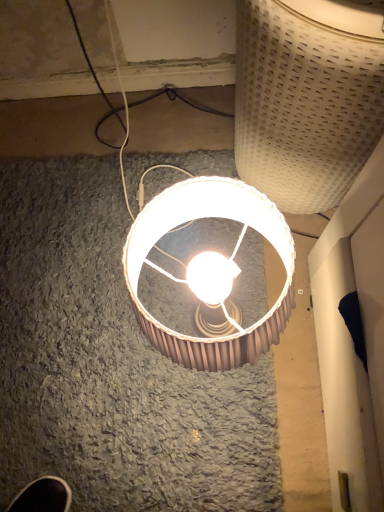
Question: Can you confirm if white woven basket at upper right, positioned as the first lamp in top-to-bottom order, is taller than matte brown lampshade at center, positioned as the first lamp in bottom-to-top order?

Choices:
 (A) yes
 (B) no

Answer: (A)

Question: Is white woven basket at upper right, positioned as the first lamp in top-to-bottom order, further to camera compared to matte brown lampshade at center, positioned as the first lamp in bottom-to-top order?

Choices:
 (A) no
 (B) yes

Answer: (A)

Question: Is matte brown lampshade at center, positioned as the first lamp in bottom-to-top order, completely or partially inside white woven basket at upper right, arranged as the second lamp when ordered from the bottom?

Choices:
 (A) no
 (B) yes

Answer: (A)

Question: Can we say white woven basket at upper right, arranged as the second lamp when ordered from the bottom, lies outside matte brown lampshade at center, the 2th lamp when ordered from top to bottom?

Choices:
 (A) no
 (B) yes

Answer: (B)

Question: Considering the relative sizes of white woven basket at upper right, arranged as the second lamp when ordered from the bottom, and matte brown lampshade at center, positioned as the first lamp in bottom-to-top order, in the image provided, is white woven basket at upper right, arranged as the second lamp when ordered from the bottom, thinner than matte brown lampshade at center, positioned as the first lamp in bottom-to-top order,?

Choices:
 (A) yes
 (B) no

Answer: (B)

Question: From a real-world perspective, does white woven basket at upper right, arranged as the second lamp when ordered from the bottom, sit lower than matte brown lampshade at center, the 2th lamp when ordered from top to bottom?

Choices:
 (A) no
 (B) yes

Answer: (A)

Question: Is matte brown lampshade at center, the 2th lamp when ordered from top to bottom, next to white woven basket at upper right, positioned as the first lamp in top-to-bottom order?

Choices:
 (A) yes
 (B) no

Answer: (B)

Question: Can you confirm if matte brown lampshade at center, the 2th lamp when ordered from top to bottom, is shorter than white woven basket at upper right, arranged as the second lamp when ordered from the bottom?

Choices:
 (A) yes
 (B) no

Answer: (A)

Question: Is matte brown lampshade at center, positioned as the first lamp in bottom-to-top order, completely or partially outside of white woven basket at upper right, arranged as the second lamp when ordered from the bottom?

Choices:
 (A) no
 (B) yes

Answer: (B)

Question: Does matte brown lampshade at center, positioned as the first lamp in bottom-to-top order, appear on the right side of white woven basket at upper right, positioned as the first lamp in top-to-bottom order?

Choices:
 (A) yes
 (B) no

Answer: (B)

Question: Does matte brown lampshade at center, positioned as the first lamp in bottom-to-top order, come behind white woven basket at upper right, arranged as the second lamp when ordered from the bottom?

Choices:
 (A) no
 (B) yes

Answer: (B)

Question: From a real-world perspective, is matte brown lampshade at center, the 2th lamp when ordered from top to bottom, positioned over white woven basket at upper right, arranged as the second lamp when ordered from the bottom, based on gravity?

Choices:
 (A) no
 (B) yes

Answer: (A)

Question: Considering the positions of white woven basket at upper right, positioned as the first lamp in top-to-bottom order, and matte brown lampshade at center, the 2th lamp when ordered from top to bottom, in the image, is white woven basket at upper right, positioned as the first lamp in top-to-bottom order, taller or shorter than matte brown lampshade at center, the 2th lamp when ordered from top to bottom,?

Choices:
 (A) short
 (B) tall

Answer: (B)